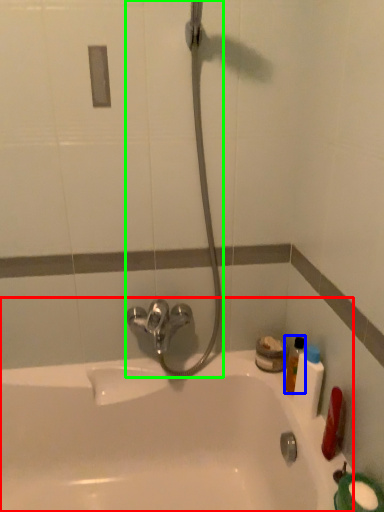
Question: Which object is positioned closest to bathtub (highlighted by a red box)? Select from mouthwash (highlighted by a blue box) and shower (highlighted by a green box).

Choices:
 (A) mouthwash
 (B) shower

Answer: (B)